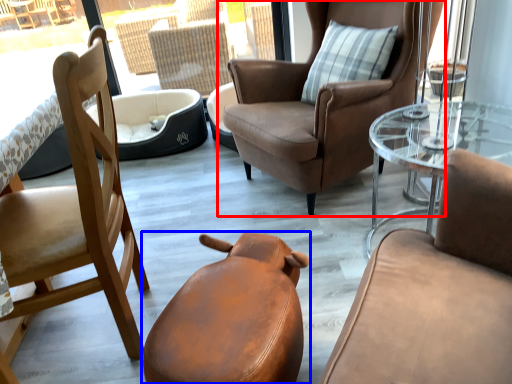
Question: Which point is further to the camera, chair (highlighted by a red box) or chair (highlighted by a blue box)?

Choices:
 (A) chair
 (B) chair

Answer: (A)